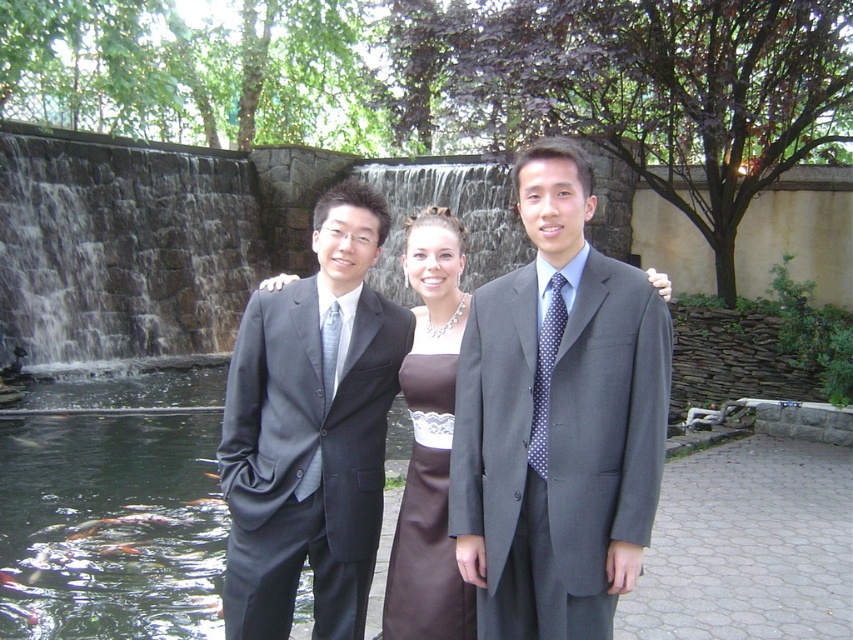
Between matte gray suit at center and shiny orange fish at center, which one appears on the left side from the viewer's perspective?

Positioned to the left is shiny orange fish at center.

Between matte gray suit at center and shiny orange fish at center, which one is positioned lower?

shiny orange fish at center

Does point (576, 472) lie behind point (126, 545)?

No, it is in front of (126, 545).

This screenshot has height=640, width=853. In order to click on matte gray suit at center in this screenshot , I will do `click(556, 419)`.

Who is shorter, matte black suit at center or brown satin dress at center?

matte black suit at center

Can you confirm if matte black suit at center is positioned above brown satin dress at center?

No.

What do you see at coordinates (311, 429) in the screenshot? The height and width of the screenshot is (640, 853). I see `matte black suit at center` at bounding box center [311, 429].

You are a GUI agent. You are given a task and a screenshot of the screen. Output one action in this format:
    pyautogui.click(x=<x>, y=<y>)
    Task: Click on the matte black suit at center
    The width and height of the screenshot is (853, 640).
    Given the screenshot: What is the action you would take?
    pyautogui.click(x=311, y=429)

Is matte gray suit at center above matte black suit at center?

Actually, matte gray suit at center is below matte black suit at center.

The image size is (853, 640). What do you see at coordinates (556, 419) in the screenshot?
I see `matte gray suit at center` at bounding box center [556, 419].

Between point (523, 205) and point (337, 380), which one is positioned behind?

Point (337, 380)

At what (x,y) coordinates should I click in order to perform the action: click on matte gray suit at center. Please return your answer as a coordinate pair (x, y). Looking at the image, I should click on (556, 419).